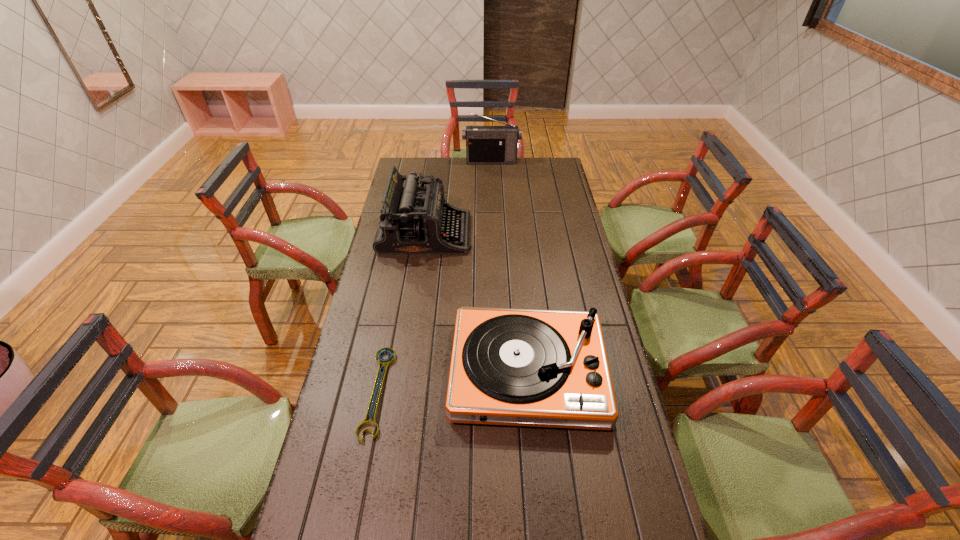
Identify the location of free spot between the second farthest object and the record player. (477, 302).

Where is `free spot between the farthest object and the third tallest object`? free spot between the farthest object and the third tallest object is located at coordinates (510, 266).

Identify the location of object that is the second nearest to the wrench. tap(414, 220).

The image size is (960, 540). I want to click on object that is the third closest to the farthest object, so click(383, 362).

Image resolution: width=960 pixels, height=540 pixels. In order to click on free point that satisfies the following two spatial constraints: 1. on the front-facing side of the radio receiver; 2. on the keyboard of the second farthest object in this screenshot , I will do `click(494, 233)`.

You are a GUI agent. You are given a task and a screenshot of the screen. Output one action in this format:
    pyautogui.click(x=<x>, y=<y>)
    Task: Click on the vacant region that satisfies the following two spatial constraints: 1. on the front-facing side of the radio receiver; 2. on the right side of the second shortest object
    Image resolution: width=960 pixels, height=540 pixels.
    Given the screenshot: What is the action you would take?
    pyautogui.click(x=499, y=372)

Identify the location of free region that satisfies the following two spatial constraints: 1. on the keyboard of the second farthest object; 2. on the left side of the record player. This screenshot has height=540, width=960. (405, 372).

The width and height of the screenshot is (960, 540). I want to click on free region that satisfies the following two spatial constraints: 1. on the back side of the second shortest object; 2. on the keyboard of the typewriter, so (x=515, y=233).

The height and width of the screenshot is (540, 960). I want to click on vacant area in the image that satisfies the following two spatial constraints: 1. on the front-facing side of the third tallest object; 2. on the right side of the farthest object, so pyautogui.click(x=499, y=372).

Identify the location of free spot that satisfies the following two spatial constraints: 1. on the front-facing side of the second shortest object; 2. on the left side of the farthest object. (499, 372).